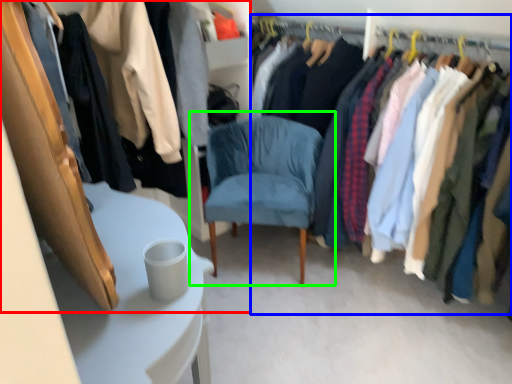
Question: Which object is positioned closest to closet (highlighted by a red box)? Select from closet (highlighted by a blue box) and chair (highlighted by a green box).

Choices:
 (A) closet
 (B) chair

Answer: (B)